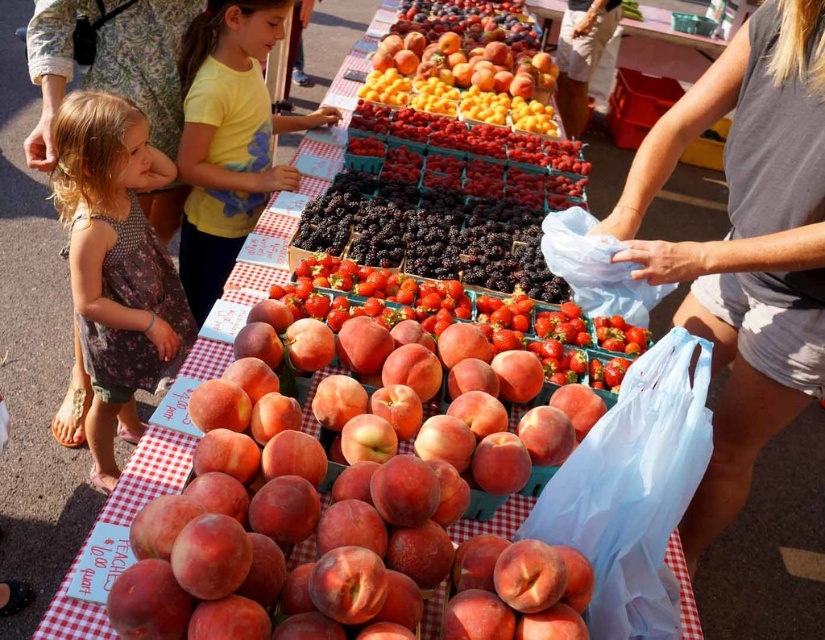
You are a customer at the market looking at the yellow cotton shirt at upper center and the glossy yellow apricots at center. Which item is closer to the top of the image?

The glossy yellow apricots at center are positioned above the yellow cotton shirt at upper center, so they are closer to the top of the image.

You are a customer at the market and want to pick up both items located at point [153,349] and point [243,228]. Which item should you grab first to minimize walking distance?

You should grab the item at point [153,349] first because it is closer to you than the item at point [243,228].